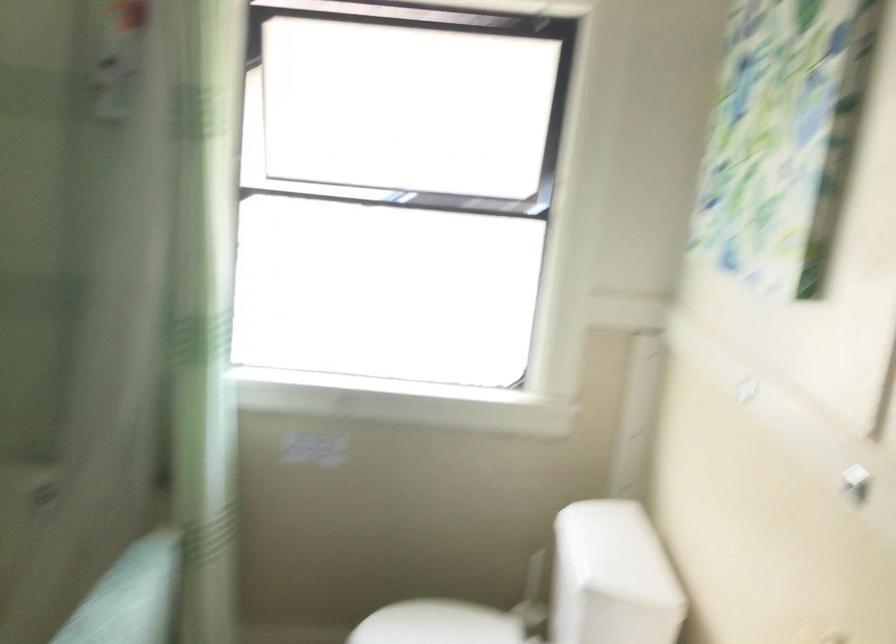
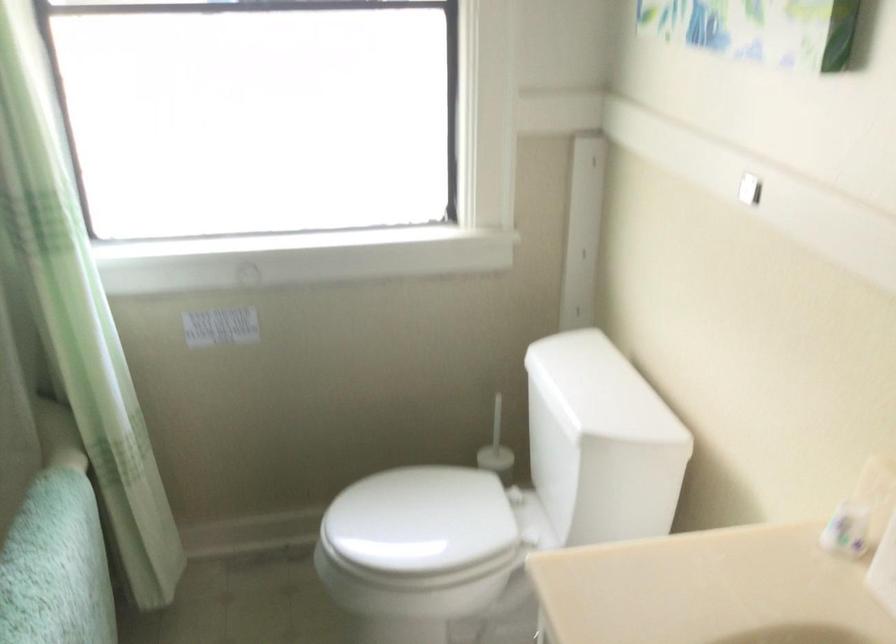
Question: The first image is from the beginning of the video and the second image is from the end. How did the camera likely rotate when shooting the video?

Choices:
 (A) Left
 (B) Right
 (C) Up
 (D) Down

Answer: (D)